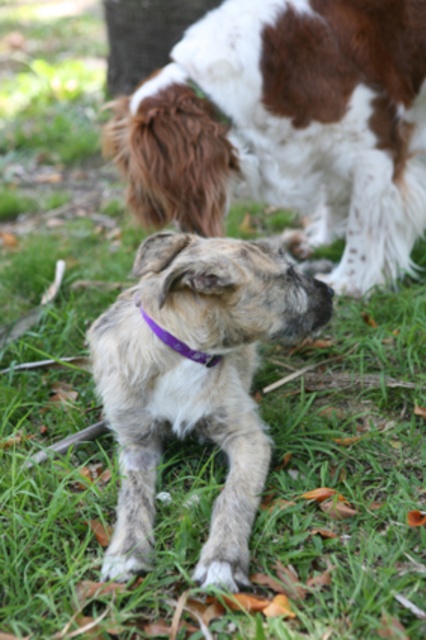
Question: Among these objects, which one is nearest to the camera?

Choices:
 (A) purple fabric neckband at center
 (B) short-haired brown dog at center
 (C) fuzzy gray dog at center
 (D) fuzzy fur paw at lower center

Answer: (D)

Question: From the image, what is the correct spatial relationship of short-haired brown dog at center in relation to purple fabric neckband at center?

Choices:
 (A) right
 (B) left

Answer: (A)

Question: Does fuzzy fur paw at lower center have a larger size compared to purple fabric neckband at center?

Choices:
 (A) yes
 (B) no

Answer: (B)

Question: Which of the following is the closest to the observer?

Choices:
 (A) short-haired brown dog at center
 (B) fuzzy fur paw at lower center
 (C) fuzzy gray dog at center

Answer: (B)

Question: Is the position of short-haired brown dog at center more distant than that of fuzzy gray dog at center?

Choices:
 (A) no
 (B) yes

Answer: (B)

Question: Estimate the real-world distances between objects in this image. Which object is closer to the fuzzy fur paw at lower center?

Choices:
 (A) fuzzy gray dog at center
 (B) purple fabric neckband at center

Answer: (A)